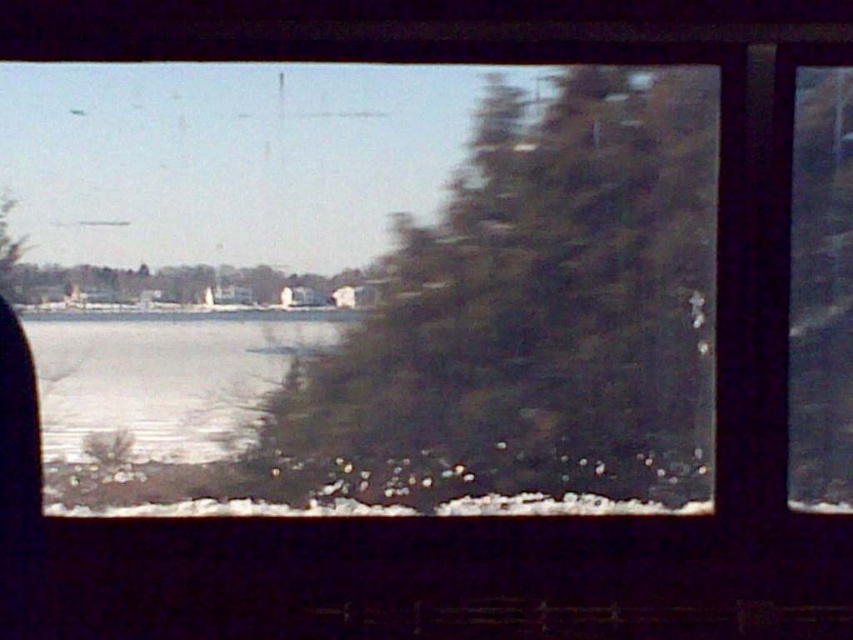
Which of these two, green textured tree at center or clear ice at lower left, stands shorter?

clear ice at lower left is shorter.

Is green textured tree at center in front of clear ice at lower left?

Yes.

What do you see at coordinates (529, 316) in the screenshot? The image size is (853, 640). I see `green textured tree at center` at bounding box center [529, 316].

This screenshot has height=640, width=853. Find the location of `green textured tree at center`. green textured tree at center is located at coordinates (529, 316).